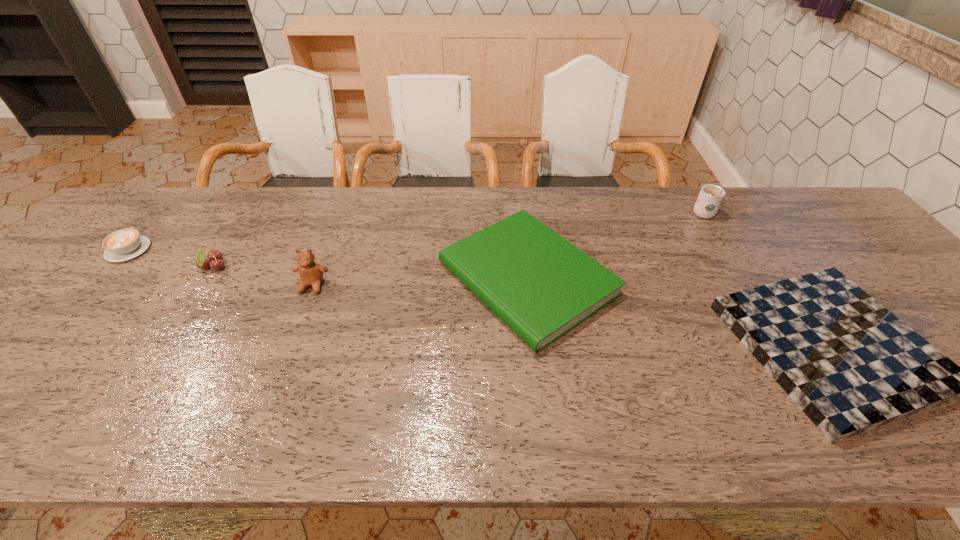
You are a GUI agent. You are given a task and a screenshot of the screen. Output one action in this format:
    pyautogui.click(x=<x>, y=<y>)
    Task: Click on the cup
    
    Given the screenshot: What is the action you would take?
    pyautogui.click(x=710, y=197)

Where is `teddy bear`? This screenshot has height=540, width=960. teddy bear is located at coordinates (311, 273).

The image size is (960, 540). I want to click on the fifth object from right to left, so click(x=215, y=262).

The image size is (960, 540). In order to click on the third tallest object in this screenshot , I will do `click(215, 262)`.

The width and height of the screenshot is (960, 540). Identify the location of the third object from right to left. (540, 285).

Where is `cappuccino`? The height and width of the screenshot is (540, 960). cappuccino is located at coordinates (125, 244).

The height and width of the screenshot is (540, 960). Find the location of `vacant space located on the side with the handle of the cup`. vacant space located on the side with the handle of the cup is located at coordinates (690, 191).

The width and height of the screenshot is (960, 540). I want to click on free space located on the side with the handle of the cup, so click(x=691, y=193).

I want to click on free space located 0.180m on the face of the teddy bear, so click(287, 355).

The height and width of the screenshot is (540, 960). I want to click on free space located on the leaves of the third tallest object, so click(268, 267).